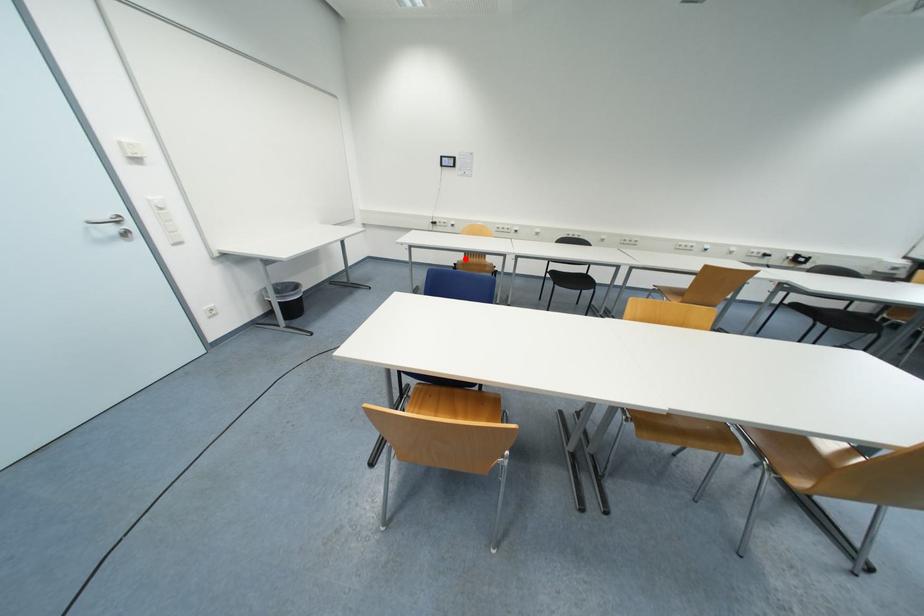
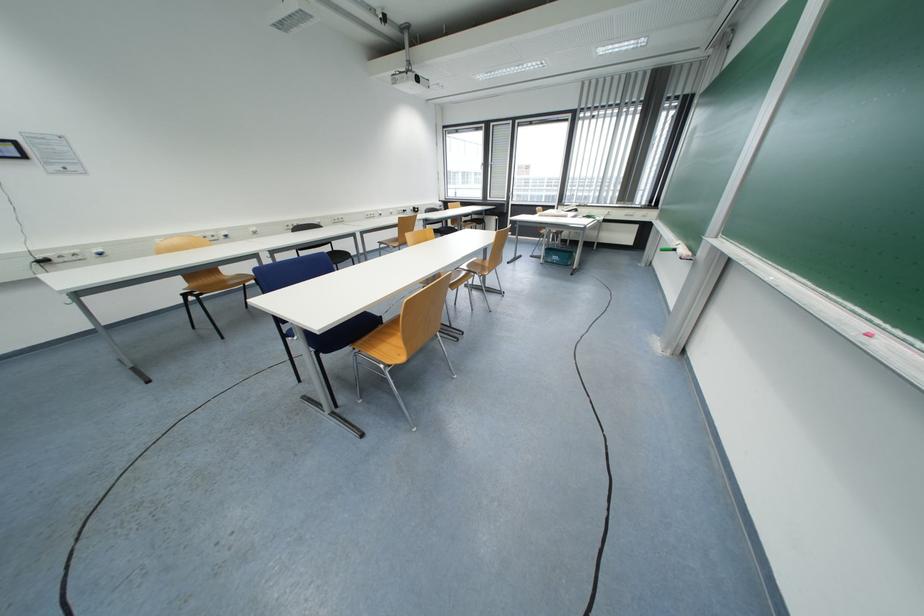
Question: I am providing you with two images of the same scene from different viewpoints. In image1, a red point is highlighted. Considering the same 3D point in image2, which of the following is correct?

Choices:
 (A) It is closer
 (B) It is farther

Answer: (B)